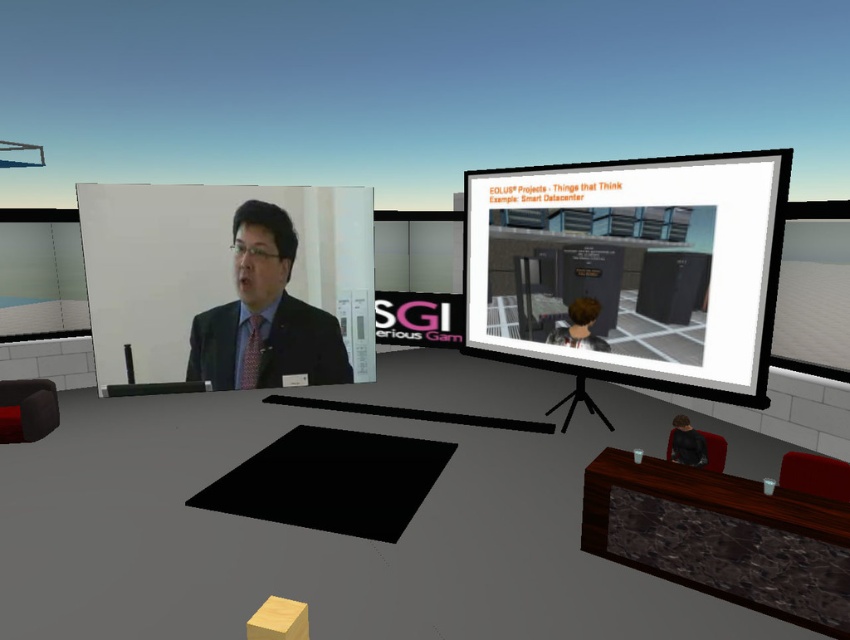
From the picture: You are attending a virtual conference and notice two screens. The left screen has a presenter wearing a matte black suit at center and has light brown hair at upper center. From the description, can you determine which object is closer to the camera on the left screen?

The matte black suit at center is in front of the light brown hair at upper center, so the matte black suit at center is closer to the camera on the left screen.

You are standing in a virtual conference room with two screens. The left screen has a presenter, and the right screen shows a 3D model of a smart datacenter. If you want to move from the left screen to the right screen, will you have enough space to walk between them without touching either? The point between them is at coordinates point (230, 344). The distance between them is 9.53 feet. Please consider your own size when answering.

The distance between the left screen and the right screen is 9.53 feet. Assuming an average person requires about 2 feet of space to walk comfortably, there is more than enough room to move between them without touching either screen.

Based on the photo, you are attending a virtual conference and notice two screens. On the left screen, there is a person presenting, and on the right screen, there are two items displayed. Which item is positioned to the right of the other? The options are the matte black suit at center and the pink satin tie at center.

The matte black suit at center is positioned to the right of the pink satin tie at center.